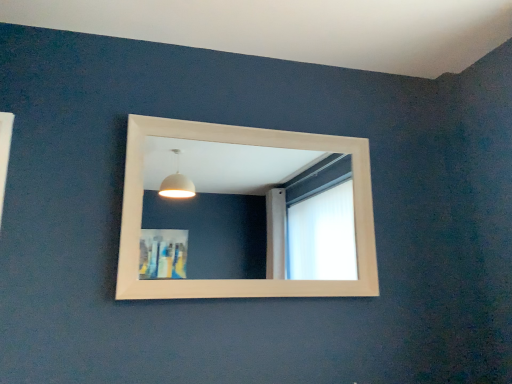
Image resolution: width=512 pixels, height=384 pixels. I want to click on white wooden mirror at upper center, so click(x=248, y=213).

Measure the distance between point [339,168] and camera.

Point [339,168] is 3.92 meters away from camera.

This screenshot has width=512, height=384. Describe the element at coordinates (248, 213) in the screenshot. I see `white wooden mirror at upper center` at that location.

I want to click on white wooden mirror at upper center, so (248, 213).